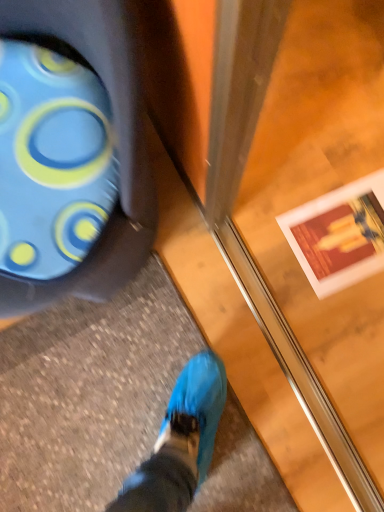
Question: Is transparent glass screen door at center wider or thinner than blue rubber boot at lower left?

Choices:
 (A) thin
 (B) wide

Answer: (A)

Question: Is point (339, 421) positioned closer to the camera than point (56, 101)?

Choices:
 (A) closer
 (B) farther

Answer: (B)

Question: Is transparent glass screen door at center spatially inside blue rubber boot at lower left, or outside of it?

Choices:
 (A) outside
 (B) inside

Answer: (A)

Question: Is point (26, 134) closer or farther from the camera than point (317, 182)?

Choices:
 (A) farther
 (B) closer

Answer: (B)

Question: Considering the positions of blue rubber boot at lower left and transparent glass screen door at center in the image, is blue rubber boot at lower left bigger or smaller than transparent glass screen door at center?

Choices:
 (A) small
 (B) big

Answer: (A)

Question: Is blue rubber boot at lower left inside or outside of transparent glass screen door at center?

Choices:
 (A) outside
 (B) inside

Answer: (A)

Question: In terms of width, does blue rubber boot at lower left look wider or thinner when compared to transparent glass screen door at center?

Choices:
 (A) wide
 (B) thin

Answer: (A)